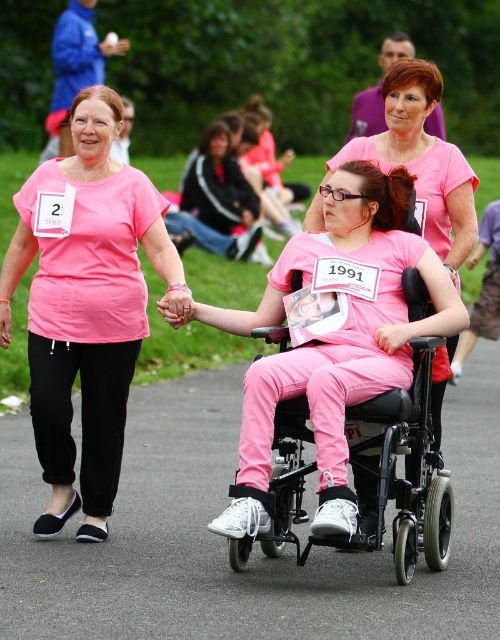
You are a photographer at the event and need to frame a photo that includes both the pink fabric pants at center and the pink matte wheelchair at center. Which object is wider so that it can be centered in the frame without being cut off?

The pink fabric pants at center is wider than the pink matte wheelchair at center, so it should be centered in the frame to avoid being cut off.

You are a photographer at the event and want to capture a photo of the pink fabric pants at center. Where should you position your camera to ensure the pants are centered in the frame?

To center the pink fabric pants at center in the frame, position your camera at the coordinates corresponding to point 0.844 on the x and 0.448 on the y axis, as the 2D location of the pink fabric pants at center is at point (224, 540).